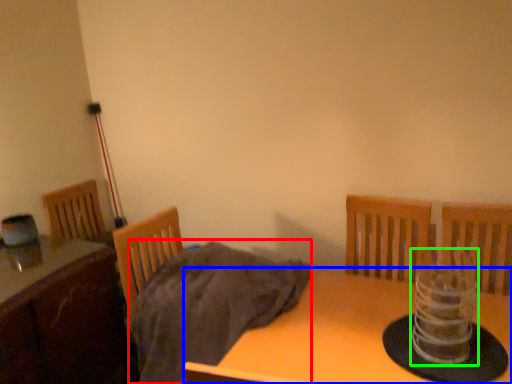
Question: Considering the real-world distances, which object is closest to blanket (highlighted by a red box)? table (highlighted by a blue box) or candle holder (highlighted by a green box).

Choices:
 (A) table
 (B) candle holder

Answer: (A)